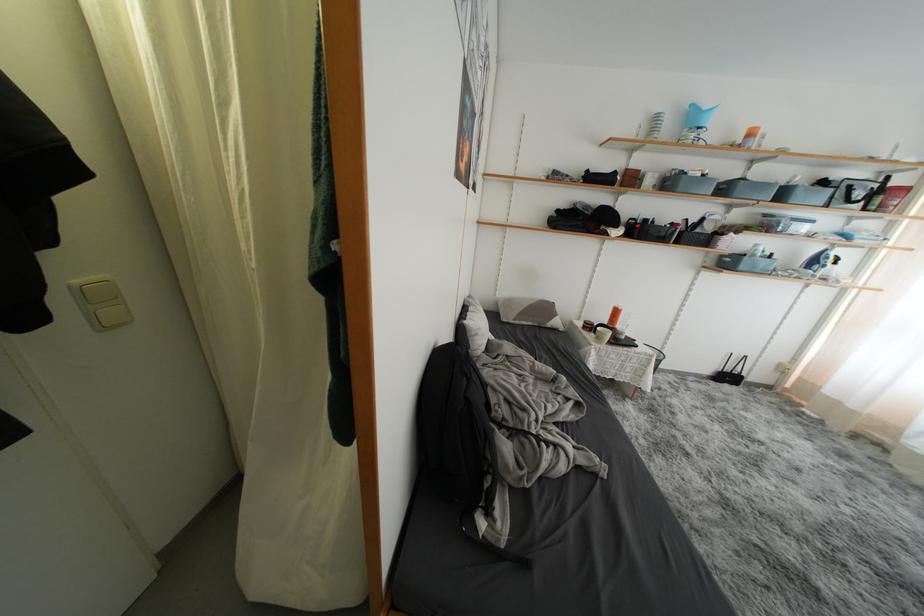
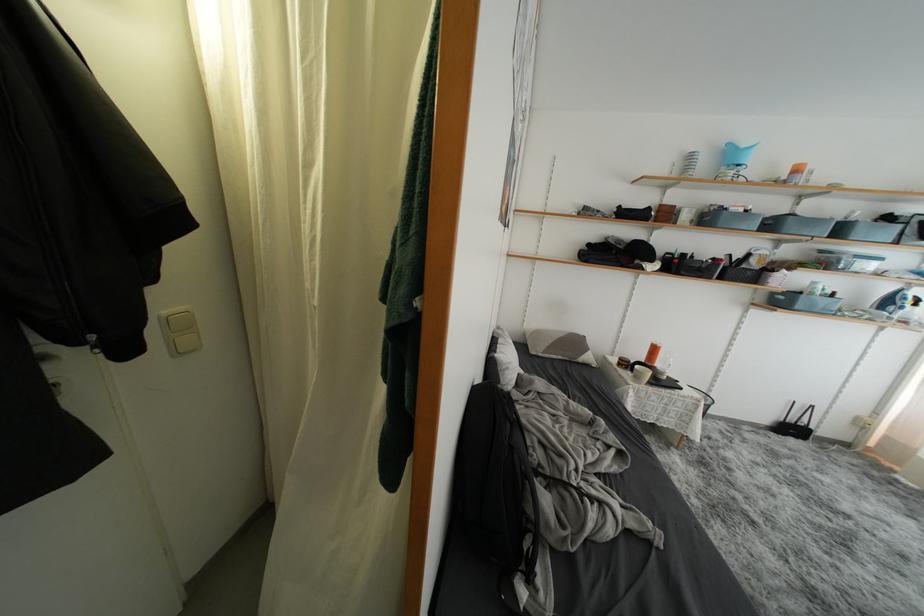
The point at (x=716, y=267) is marked in the first image. Where is the corresponding point in the second image?

(767, 304)